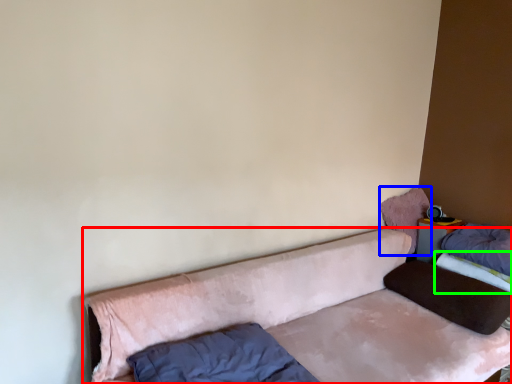
Question: Estimate the real-world distances between objects in this image. Which object is farther from studio couch (highlighted by a red box), pillow (highlighted by a blue box) or mattress (highlighted by a green box)?

Choices:
 (A) pillow
 (B) mattress

Answer: (B)